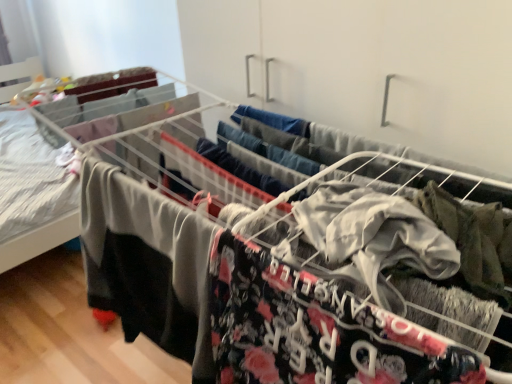
Question: Should I look upward or downward to see gray fabric at center?

Choices:
 (A) down
 (B) up

Answer: (A)